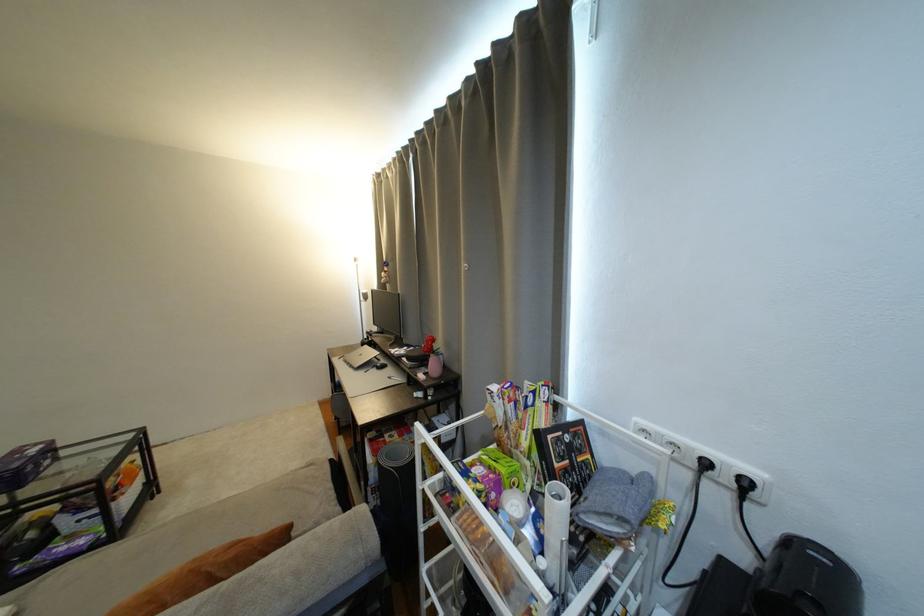
Find the location of `laptop lid`. laptop lid is located at coordinates (365, 374).